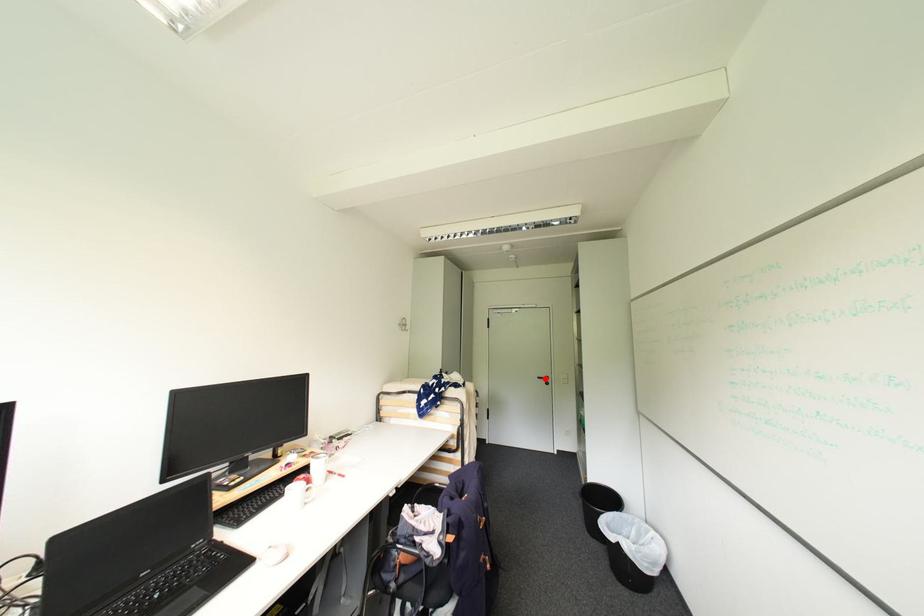
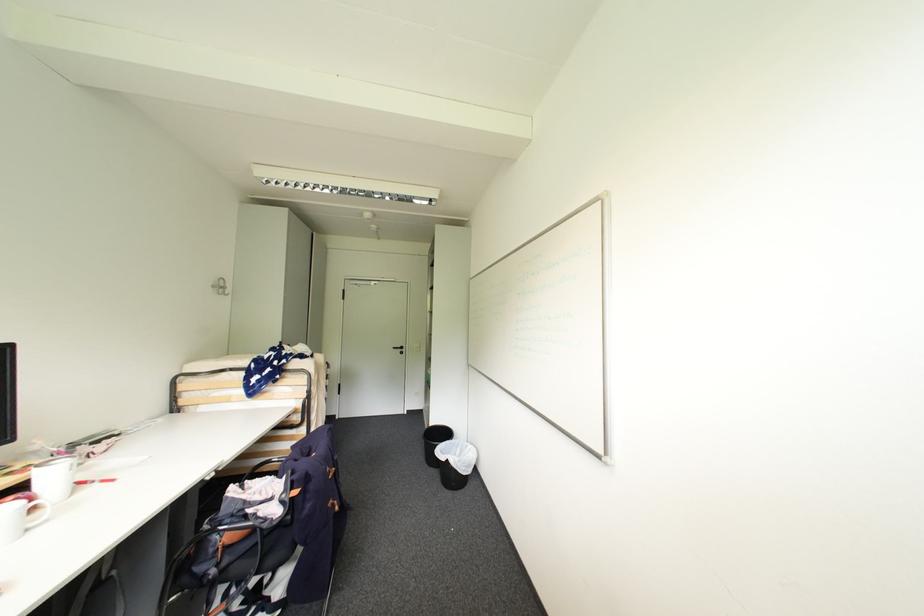
Where in the second image is the point corresponding to the highlighted location from the first image?

(400, 349)